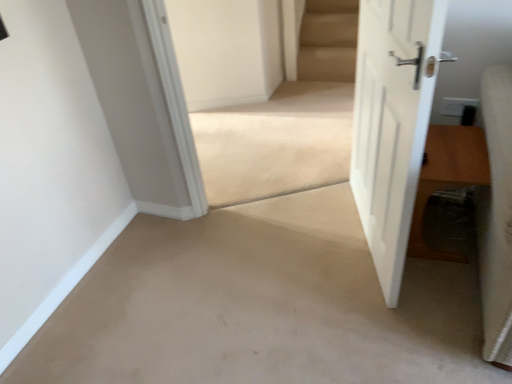
Question: Can we say beige carpet at center lies outside brown wooden table at right?

Choices:
 (A) yes
 (B) no

Answer: (A)

Question: Could you tell me if beige carpet at center is turned towards brown wooden table at right?

Choices:
 (A) no
 (B) yes

Answer: (A)

Question: Is beige carpet at center directly adjacent to brown wooden table at right?

Choices:
 (A) no
 (B) yes

Answer: (A)

Question: Is beige carpet at center to the left of brown wooden table at right from the viewer's perspective?

Choices:
 (A) no
 (B) yes

Answer: (B)

Question: Is beige carpet at center at the right side of brown wooden table at right?

Choices:
 (A) yes
 (B) no

Answer: (B)

Question: Is beige carpet at center wider than brown wooden table at right?

Choices:
 (A) yes
 (B) no

Answer: (B)

Question: Can white matte door at right be found inside brown wooden table at right?

Choices:
 (A) yes
 (B) no

Answer: (B)

Question: Is brown wooden table at right thinner than white matte door at right?

Choices:
 (A) no
 (B) yes

Answer: (A)

Question: Are brown wooden table at right and white matte door at right located far from each other?

Choices:
 (A) yes
 (B) no

Answer: (B)

Question: From a real-world perspective, is brown wooden table at right over white matte door at right?

Choices:
 (A) no
 (B) yes

Answer: (A)

Question: Does brown wooden table at right touch white matte door at right?

Choices:
 (A) yes
 (B) no

Answer: (B)

Question: From the image's perspective, is brown wooden table at right on white matte door at right?

Choices:
 (A) no
 (B) yes

Answer: (A)

Question: Considering the relative sizes of white matte door at right and beige carpet at center in the image provided, is white matte door at right wider than beige carpet at center?

Choices:
 (A) no
 (B) yes

Answer: (A)